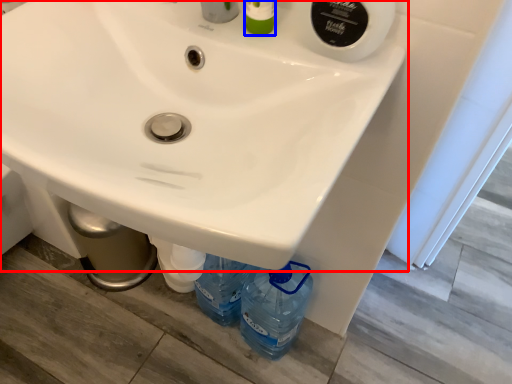
Question: Which object is closer to the camera taking this photo, sink (highlighted by a red box) or toiletry (highlighted by a blue box)?

Choices:
 (A) sink
 (B) toiletry

Answer: (A)